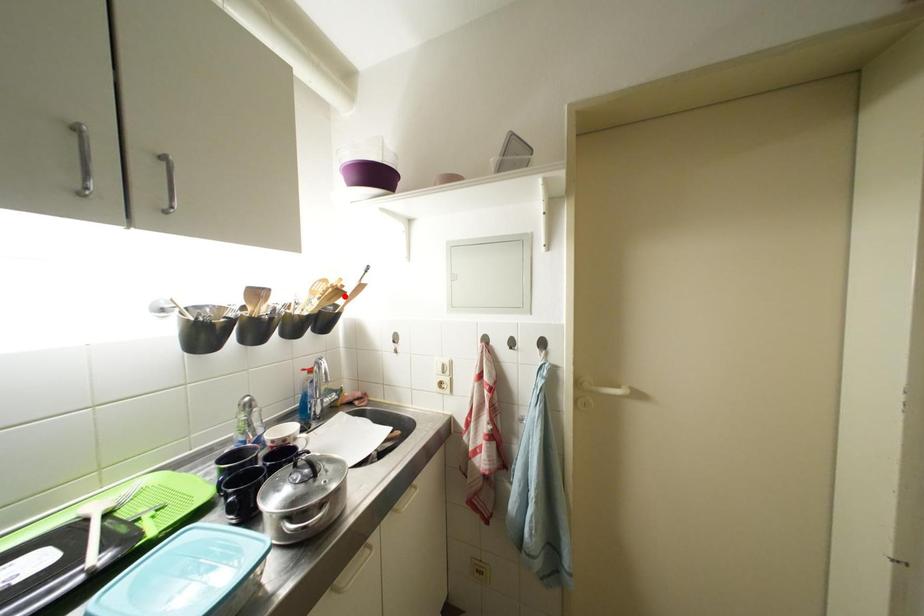
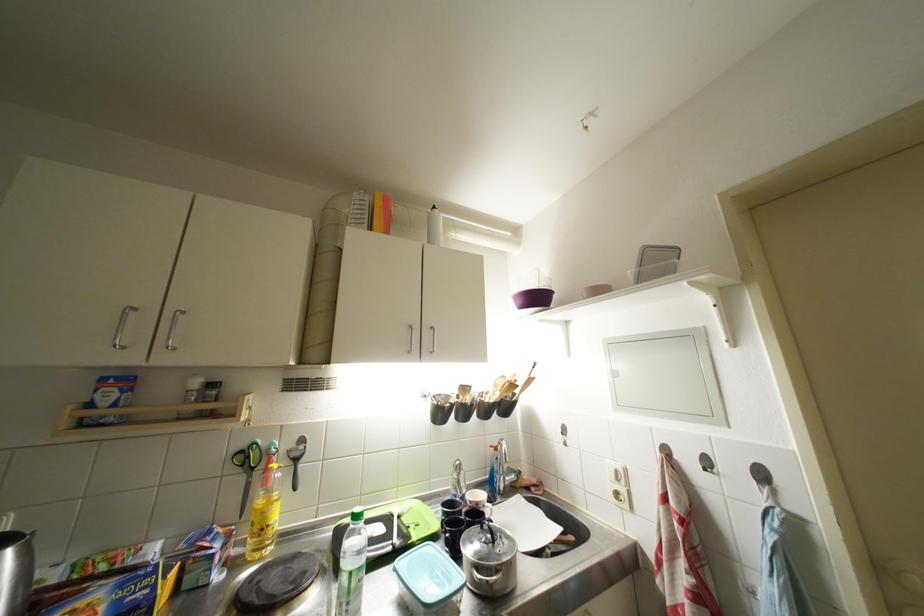
The point at the highlighted location is marked in the first image. Where is the corresponding point in the second image?

(519, 390)